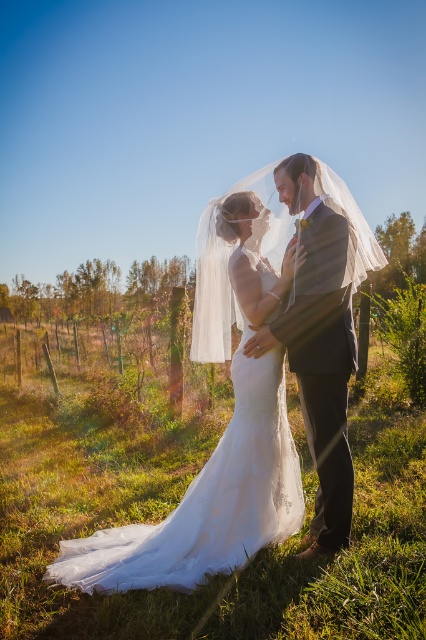
Between white lace dress at center and white sheer veil at center, which one has more height?

With more height is white lace dress at center.

Is white lace dress at center thinner than white sheer veil at center?

No, white lace dress at center is not thinner than white sheer veil at center.

Is point (224, 516) farther from viewer compared to point (276, 204)?

No, it is not.

The image size is (426, 640). In order to click on white lace dress at center in this screenshot , I will do `click(215, 454)`.